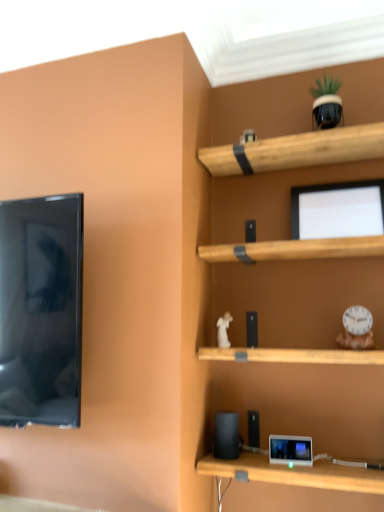
Measure the distance between white glossy figurine at center, placed as the 1th toy when sorted from left to right, and camera.

white glossy figurine at center, placed as the 1th toy when sorted from left to right, and camera are 5.49 feet apart from each other.

Where is `white plastic clock at right, which is the first toy in right-to-left order`? This screenshot has width=384, height=512. white plastic clock at right, which is the first toy in right-to-left order is located at coordinates (357, 329).

Locate an element on the screen. The height and width of the screenshot is (512, 384). black matte speaker at lower center is located at coordinates (226, 435).

Measure the distance between matte black monitor at upper center and camera.

5.02 feet.

This screenshot has width=384, height=512. I want to click on green matte plant pot at upper right, the second toy positioned from the right, so click(x=326, y=104).

Is white glossy figurine at center, placed as the 1th toy when sorted from left to right, beside matte black monitor at upper center?

No, white glossy figurine at center, placed as the 1th toy when sorted from left to right, is not making contact with matte black monitor at upper center.

Can you confirm if white glossy figurine at center, positioned as the 1th toy in bottom-to-top order, is thinner than matte black monitor at upper center?

Indeed, white glossy figurine at center, positioned as the 1th toy in bottom-to-top order, has a lesser width compared to matte black monitor at upper center.

Looking at the image, does white glossy figurine at center, which is counted as the third toy, starting from the top, seem bigger or smaller compared to matte black monitor at upper center?

Considering their sizes, white glossy figurine at center, which is counted as the third toy, starting from the top, takes up less space than matte black monitor at upper center.

Identify the location of computer monitor lying on the right of white glossy figurine at center, the 3th toy positioned from the right. The width and height of the screenshot is (384, 512). (337, 210).

How many degrees apart are the facing directions of black matte speaker at lower center and white plastic clock at right, which ranks as the second toy in top-to-bottom order?

They differ by 14.2 degrees in their facing directions.

Is black matte speaker at lower center aimed at white plastic clock at right, which is the first toy in right-to-left order?

No, black matte speaker at lower center is not turned towards white plastic clock at right, which is the first toy in right-to-left order.

From the image's perspective, is black matte speaker at lower center on white plastic clock at right, which appears as the third toy when viewed from the left?

No.

From a real-world perspective, between black matte speaker at lower center and white plastic clock at right, which is the first toy in right-to-left order, who is vertically higher?

From a 3D spatial view, white plastic clock at right, which is the first toy in right-to-left order, is above.

From a real-world perspective, is green matte plant pot at upper right, the 3th toy from the bottom, physically above white glossy figurine at center, positioned as the 1th toy in bottom-to-top order?

Yes, from a real-world perspective, green matte plant pot at upper right, the 3th toy from the bottom, is on top of white glossy figurine at center, positioned as the 1th toy in bottom-to-top order.

Are green matte plant pot at upper right, the second toy positioned from the right, and white glossy figurine at center, placed as the 1th toy when sorted from left to right, located far from each other?

green matte plant pot at upper right, the second toy positioned from the right, is actually quite close to white glossy figurine at center, placed as the 1th toy when sorted from left to right.

Which toy is the 1st one when counting from the front of the white glossy figurine at center, positioned as the 1th toy in bottom-to-top order? Please provide its 2D coordinates.

[(326, 104)]

Considering the sizes of objects green matte plant pot at upper right, the 2th toy from the left, and white glossy figurine at center, which is counted as the third toy, starting from the top, in the image provided, who is bigger, green matte plant pot at upper right, the 2th toy from the left, or white glossy figurine at center, which is counted as the third toy, starting from the top,?

Bigger between the two is green matte plant pot at upper right, the 2th toy from the left.

Are white plastic clock at right, which is the first toy in right-to-left order, and green matte plant pot at upper right, the 1th toy when ordered from top to bottom, beside each other?

No, white plastic clock at right, which is the first toy in right-to-left order, is not making contact with green matte plant pot at upper right, the 1th toy when ordered from top to bottom.

Could you tell me if white plastic clock at right, which is counted as the second toy, starting from the bottom, is facing green matte plant pot at upper right, the 3th toy from the bottom?

No, white plastic clock at right, which is counted as the second toy, starting from the bottom, is not facing towards green matte plant pot at upper right, the 3th toy from the bottom.

Which is correct: white plastic clock at right, which appears as the third toy when viewed from the left, is inside green matte plant pot at upper right, the 2th toy from the left, or outside of it?

The correct answer is: outside.

Based on the photo, between white plastic clock at right, which appears as the third toy when viewed from the left, and green matte plant pot at upper right, the 3th toy from the bottom, which one has larger size?

With larger size is green matte plant pot at upper right, the 3th toy from the bottom.

How distant is white plastic clock at right, which is the first toy in right-to-left order, from matte black tablet at lower center?

The distance of white plastic clock at right, which is the first toy in right-to-left order, from matte black tablet at lower center is 16.43 inches.

Are white plastic clock at right, which is the first toy in right-to-left order, and matte black tablet at lower center far apart?

No, white plastic clock at right, which is the first toy in right-to-left order, is in close proximity to matte black tablet at lower center.

Considering the relative positions of white plastic clock at right, which is the first toy in right-to-left order, and matte black tablet at lower center in the image provided, is white plastic clock at right, which is the first toy in right-to-left order, to the left or to the right of matte black tablet at lower center?

Based on their positions, white plastic clock at right, which is the first toy in right-to-left order, is located to the right of matte black tablet at lower center.

From a real-world perspective, which is physically above, white plastic clock at right, which ranks as the second toy in top-to-bottom order, or matte black tablet at lower center?

In real-world perspective, white plastic clock at right, which ranks as the second toy in top-to-bottom order, is above.

From the image's perspective, is green matte plant pot at upper right, the 3th toy from the bottom, above or below black matte speaker at lower center?

From the image's perspective, green matte plant pot at upper right, the 3th toy from the bottom, appears above black matte speaker at lower center.

Between green matte plant pot at upper right, the 2th toy from the left, and black matte speaker at lower center, which one is positioned behind?

green matte plant pot at upper right, the 2th toy from the left.

Considering the sizes of green matte plant pot at upper right, the 2th toy from the left, and black matte speaker at lower center in the image, is green matte plant pot at upper right, the 2th toy from the left, wider or thinner than black matte speaker at lower center?

Considering their sizes, green matte plant pot at upper right, the 2th toy from the left, looks broader than black matte speaker at lower center.

Who is shorter, green matte plant pot at upper right, the 1th toy when ordered from top to bottom, or black matte speaker at lower center?

With less height is black matte speaker at lower center.

Can you confirm if green matte plant pot at upper right, the second toy positioned from the right, is thinner than matte black tablet at lower center?

No, green matte plant pot at upper right, the second toy positioned from the right, is not thinner than matte black tablet at lower center.

How many degrees apart are the facing directions of green matte plant pot at upper right, the 2th toy from the left, and matte black tablet at lower center?

They differ by 6 degrees in their facing directions.

Does green matte plant pot at upper right, the 1th toy when ordered from top to bottom, have a larger size compared to matte black tablet at lower center?

Yes, green matte plant pot at upper right, the 1th toy when ordered from top to bottom, is bigger than matte black tablet at lower center.

In the scene shown: Is matte black tablet at lower center at the back of green matte plant pot at upper right, the 1th toy when ordered from top to bottom?

That's not correct — green matte plant pot at upper right, the 1th toy when ordered from top to bottom, is not looking away from matte black tablet at lower center.

Locate an element on the screen. This screenshot has width=384, height=512. the 2nd toy counting from the left of the matte black monitor at upper center is located at coordinates (223, 330).

You are a GUI agent. You are given a task and a screenshot of the screen. Output one action in this format:
    pyautogui.click(x=<x>, y=<y>)
    Task: Click on the speaker behind the white plastic clock at right, which is counted as the second toy, starting from the bottom
    The height and width of the screenshot is (512, 384).
    Given the screenshot: What is the action you would take?
    pyautogui.click(x=226, y=435)

When comparing their distances from white glossy figurine at center, the 3th toy positioned from the right, does green matte plant pot at upper right, the second toy positioned from the right, or matte black monitor at upper center seem further?

green matte plant pot at upper right, the second toy positioned from the right.

Based on their spatial positions, is matte black tablet at lower center or green matte plant pot at upper right, the second toy positioned from the right, further from matte black monitor at upper center?

Among the two, matte black tablet at lower center is located further to matte black monitor at upper center.

When comparing their distances from green matte plant pot at upper right, the 1th toy when ordered from top to bottom, does white plastic clock at right, which is counted as the second toy, starting from the bottom, or black matte speaker at lower center seem further?

The object further to green matte plant pot at upper right, the 1th toy when ordered from top to bottom, is black matte speaker at lower center.

Based on their spatial positions, is matte black monitor at upper center or white plastic clock at right, which is counted as the second toy, starting from the bottom, further from matte black tablet at lower center?

matte black monitor at upper center is further to matte black tablet at lower center.

From the picture: Which object lies nearer to the anchor point black matte speaker at lower center, white plastic clock at right, which ranks as the second toy in top-to-bottom order, or white glossy figurine at center, positioned as the 1th toy in bottom-to-top order?

white glossy figurine at center, positioned as the 1th toy in bottom-to-top order, is positioned closer to the anchor black matte speaker at lower center.

When comparing their distances from matte black tablet at lower center, does green matte plant pot at upper right, the 1th toy when ordered from top to bottom, or white plastic clock at right, which is counted as the second toy, starting from the bottom, seem further?

Among the two, green matte plant pot at upper right, the 1th toy when ordered from top to bottom, is located further to matte black tablet at lower center.

Looking at the image, which one is located further to white plastic clock at right, which appears as the third toy when viewed from the left, black matte speaker at lower center or matte black monitor at upper center?

black matte speaker at lower center is further to white plastic clock at right, which appears as the third toy when viewed from the left.

Estimate the real-world distances between objects in this image. Which object is closer to matte black tablet at lower center, matte black monitor at upper center or white glossy figurine at center, placed as the 1th toy when sorted from left to right?

white glossy figurine at center, placed as the 1th toy when sorted from left to right, lies closer to matte black tablet at lower center than the other object.

In order to click on speaker between white glossy figurine at center, which is counted as the third toy, starting from the top, and matte black tablet at lower center in the up-down direction in this screenshot , I will do `click(226, 435)`.

This screenshot has width=384, height=512. I want to click on computer monitor between green matte plant pot at upper right, the 3th toy from the bottom, and matte black tablet at lower center vertically, so click(x=337, y=210).

This screenshot has width=384, height=512. In order to click on toy between white plastic clock at right, which ranks as the second toy in top-to-bottom order, and matte black tablet at lower center from top to bottom in this screenshot , I will do `click(223, 330)`.

Locate an element on the screen. speaker that lies between white plastic clock at right, which is the first toy in right-to-left order, and matte black tablet at lower center from top to bottom is located at coordinates (226, 435).